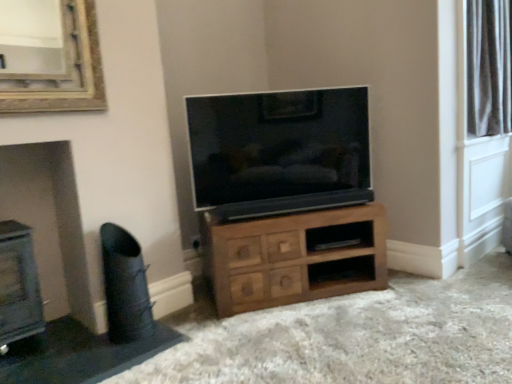
Question: Considering the positions of point (273, 274) and point (284, 105), is point (273, 274) closer or farther from the camera than point (284, 105)?

Choices:
 (A) farther
 (B) closer

Answer: (B)

Question: Would you say wooden chest of drawers at center is to the left or to the right of matte black tv at center in the picture?

Choices:
 (A) right
 (B) left

Answer: (A)

Question: Which object is positioned closest to the blue painted wood fireplace at lower left?

Choices:
 (A) wooden shelf at center
 (B) matte black tv at center
 (C) black leather swivel chair at lower left
 (D) silky white curtains at upper right
 (E) wooden chest of drawers at center

Answer: (C)

Question: Based on their relative distances, which object is farther from the silky white curtains at upper right?

Choices:
 (A) blue painted wood fireplace at lower left
 (B) black leather swivel chair at lower left
 (C) wooden shelf at center
 (D) wooden chest of drawers at center
 (E) matte black tv at center

Answer: (A)